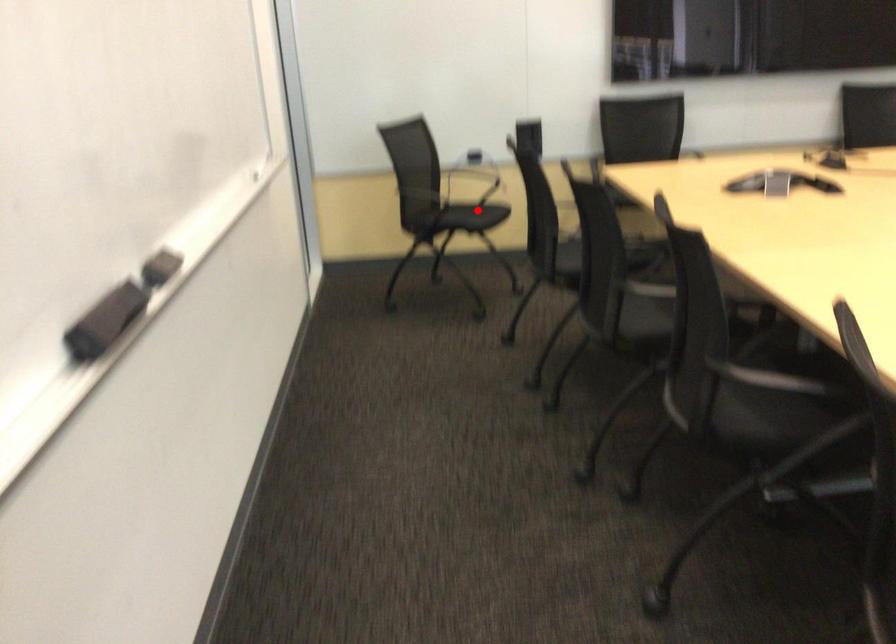
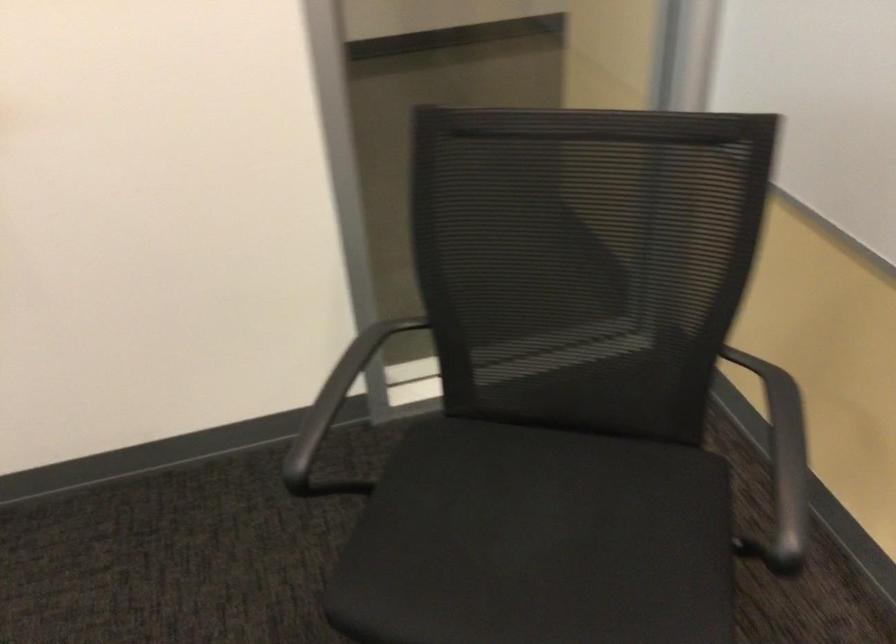
Question: A red point is marked in image1. In image2, is the corresponding 3D point closer to the camera or farther? Reply with the corresponding letter.

Choices:
 (A) The corresponding 3D point is closer.
 (B) The corresponding 3D point is farther.

Answer: (A)